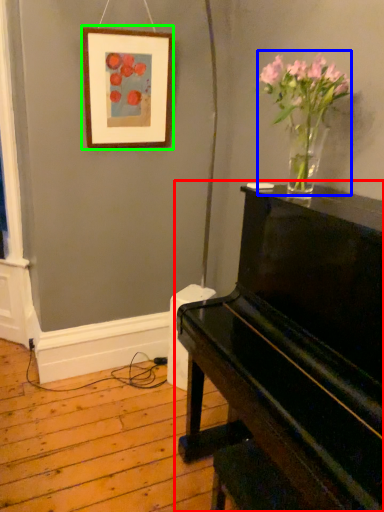
Question: Which object is positioned farthest from piano (highlighted by a red box)? Select from floral arrangement (highlighted by a blue box) and picture frame (highlighted by a green box).

Choices:
 (A) floral arrangement
 (B) picture frame

Answer: (B)